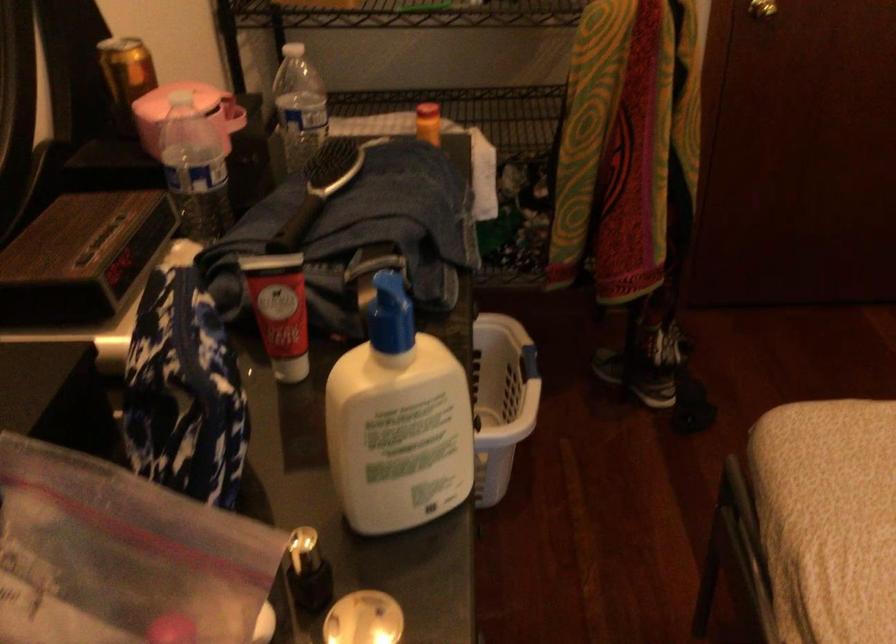
The height and width of the screenshot is (644, 896). Identify the location of chair sitting surface. (828, 488).